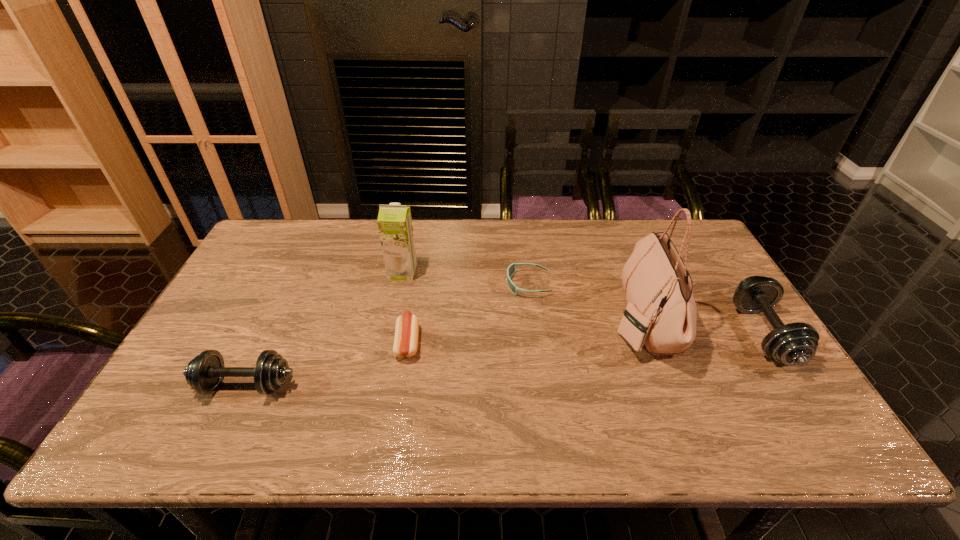
In order to click on vacant space that satisfies the following two spatial constraints: 1. on the side of the taller dumbbell with the attached pouch; 2. on the right side of the tallest object in this screenshot , I will do `click(648, 334)`.

The image size is (960, 540). I want to click on blank area in the image that satisfies the following two spatial constraints: 1. on the side of the tallest object with the attached pouch; 2. on the left side of the taller dumbbell, so click(x=648, y=334).